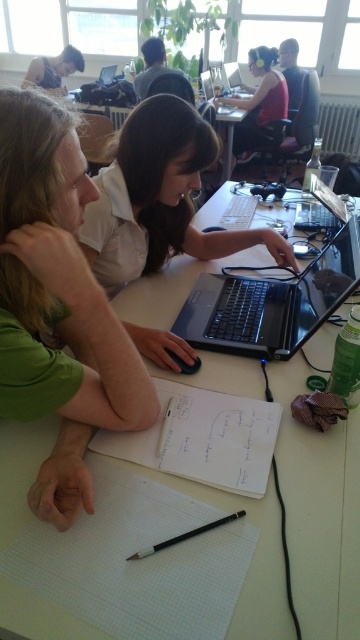
You are a furniture designer who needs to ensure that the white matte table at center can support the matte black laptop at upper center. Based on the scene description, is there a potential issue with the table being too short to properly support the laptop?

The white matte table at center is not as tall as the matte black laptop at upper center, which means the table is shorter. This could be a problem because the laptop might not sit stably or comfortably on a surface that is shorter than it. The designer should consider adjusting the table height or using a riser to ensure proper support.

You are standing in the room and want to place a new lamp on the white matte table at center. However, the lamp needs to be placed to the left of the matte black laptop at upper center. Is this possible given the current arrangement?

The white matte table at center is positioned on the right side of the matte black laptop at upper center, so placing the lamp to the left of the matte black laptop at upper center would require placing it off the table since the table is already on the right side of the laptop.

Looking at this image, you are a photographer standing in the room and want to take a photo of the matte black headphones at upper center and the matte black laptop at upper center. Which object should you focus on first if you want to capture both in sharp focus?

The matte black headphones at upper center is located below the matte black laptop at upper center. Since the headphones are closer to the camera, you should focus on the matte black headphones at upper center first to ensure both are in sharp focus.